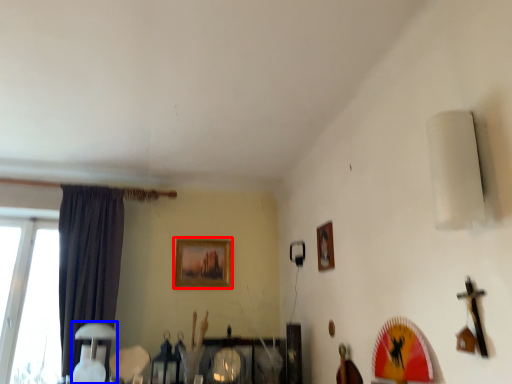
Question: Which object is closer to the camera taking this photo, picture frame (highlighted by a red box) or table lamp (highlighted by a blue box)?

Choices:
 (A) picture frame
 (B) table lamp

Answer: (B)